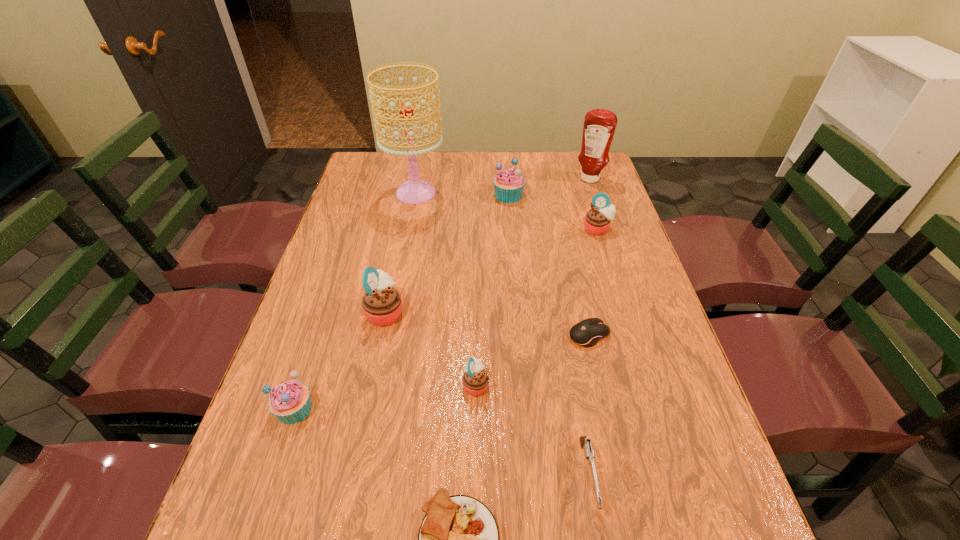
Identify the location of the tallest object. This screenshot has width=960, height=540. (415, 191).

You are a GUI agent. You are given a task and a screenshot of the screen. Output one action in this format:
    pyautogui.click(x=<x>, y=<y>)
    Task: Click on the red condiment
    The image size is (960, 540).
    Given the screenshot: What is the action you would take?
    pyautogui.click(x=599, y=126)

You are a GUI agent. You are given a task and a screenshot of the screen. Output one action in this format:
    pyautogui.click(x=<x>, y=<y>)
    Task: Click on the second tallest object
    The image size is (960, 540).
    Given the screenshot: What is the action you would take?
    pyautogui.click(x=599, y=126)

The width and height of the screenshot is (960, 540). I want to click on the third tallest object, so click(381, 304).

Locate an element on the screen. The width and height of the screenshot is (960, 540). the second nearest pink muffin is located at coordinates (381, 304).

You are a GUI agent. You are given a task and a screenshot of the screen. Output one action in this format:
    pyautogui.click(x=<x>, y=<y>)
    Task: Click on the farthest muffin
    
    Given the screenshot: What is the action you would take?
    pyautogui.click(x=508, y=184)

You are a GUI agent. You are given a task and a screenshot of the screen. Output one action in this format:
    pyautogui.click(x=<x>, y=<y>)
    Task: Click on the bigger blue muffin
    This screenshot has width=960, height=540.
    Given the screenshot: What is the action you would take?
    pyautogui.click(x=508, y=184)

The height and width of the screenshot is (540, 960). What are the coordinates of `the second biggest pink muffin` in the screenshot? It's located at (597, 221).

Find the location of a particular element. This screenshot has height=540, width=960. the seventh nearest object is located at coordinates (597, 221).

The width and height of the screenshot is (960, 540). I want to click on the nearest pink muffin, so click(475, 380).